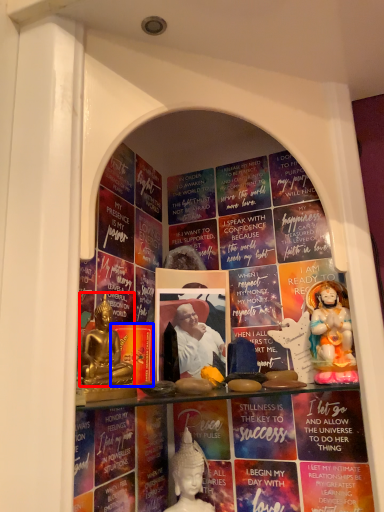
Question: Which of the following is the farthest to the observer, person (highlighted by a red box) or paperback book (highlighted by a blue box)?

Choices:
 (A) person
 (B) paperback book

Answer: (B)